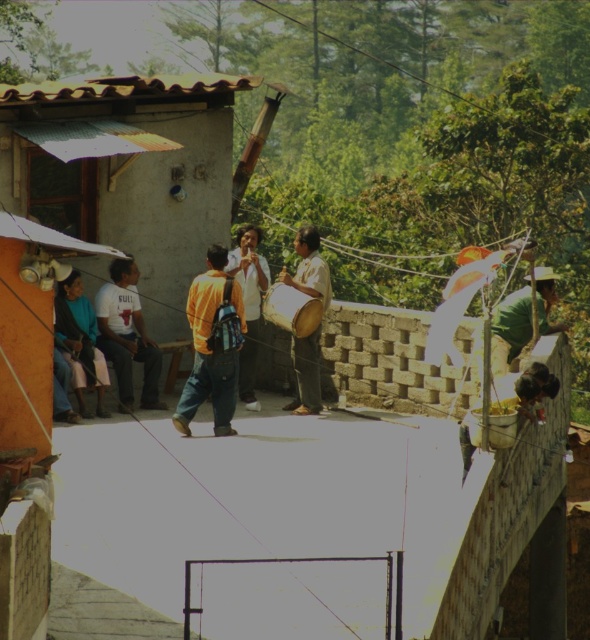
Can you confirm if white matte t-shirt at left is positioned above blue fabric jacket at lower left?

Correct, white matte t-shirt at left is located above blue fabric jacket at lower left.

Between white matte t-shirt at left and blue fabric jacket at lower left, which one is positioned higher?

white matte t-shirt at left is higher up.

Between point (130, 262) and point (81, 396), which one is positioned behind?

Point (130, 262)

This screenshot has height=640, width=590. I want to click on white matte t-shirt at left, so click(x=126, y=336).

Who is taller, orange matte backpack at center or wooden drum at center?

→ With more height is wooden drum at center.

Where is `orange matte backpack at center`? The image size is (590, 640). orange matte backpack at center is located at coordinates (211, 348).

Locate an element on the screen. The height and width of the screenshot is (640, 590). orange matte backpack at center is located at coordinates (211, 348).

Does orange matte backpack at center appear under blue fabric jacket at lower left?

No.

How much distance is there between orange matte backpack at center and blue fabric jacket at lower left?

The distance of orange matte backpack at center from blue fabric jacket at lower left is 1.05 meters.

Is point (204, 333) positioned after point (68, 310)?

No.

The height and width of the screenshot is (640, 590). Find the location of `orange matte backpack at center`. orange matte backpack at center is located at coordinates (211, 348).